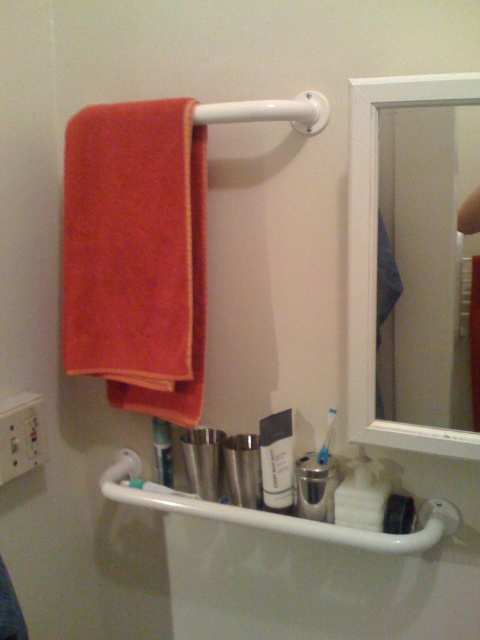
You are standing in the bathroom and want to place a new decorative item on the shelf below the orange terry cloth towel at left. The shelf is 1 meter long. If the shelf already has items occupying 0.6 meters, will there be enough space for the new item that is 0.3 meters long?

The shelf is 1 meter long and already has items occupying 0.6 meters, leaving 0.4 meters of space. Since the new item is 0.3 meters long, there is enough space on the shelf below the orange terry cloth towel at left.

You are organizing items in the bathroom and want to place a new toothbrush next to the white glossy toothpaste at lower center. However, you notice the orange terry cloth towel at left is in the way. Can you move the towel to make space without removing the toothpaste?

The orange terry cloth towel at left is above the white glossy toothpaste at lower center, so you can move the towel downward to create space for the new toothbrush next to the toothpaste.

You are standing in the bathroom and want to reach the orange terry cloth towel at left. If your arm can extend 30 inches, can you grab it without moving closer?

The orange terry cloth towel at left is 32.76 inches away from the camera, which is beyond your arm reach of 30 inches. You need to move closer to grab it.